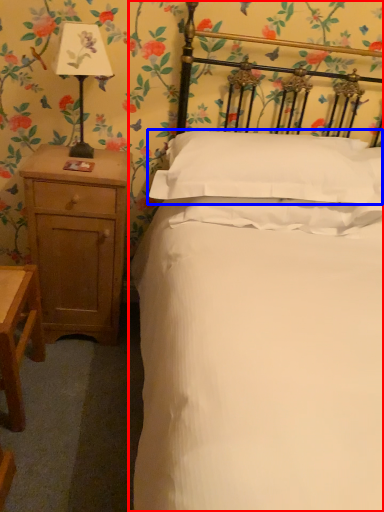
Question: Which object appears closest to the camera in this image, bed (highlighted by a red box) or pillow (highlighted by a blue box)?

Choices:
 (A) bed
 (B) pillow

Answer: (A)